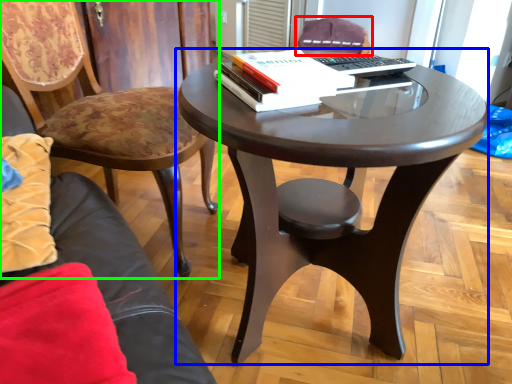
Question: Which is nearer to the chair (highlighted by a red box)? coffee table (highlighted by a blue box) or chair (highlighted by a green box).

Choices:
 (A) coffee table
 (B) chair

Answer: (B)